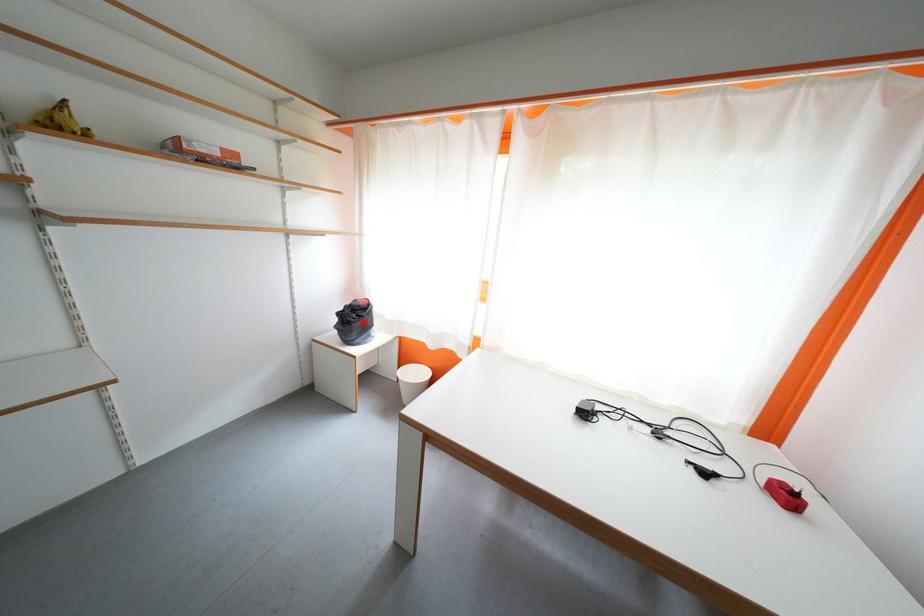
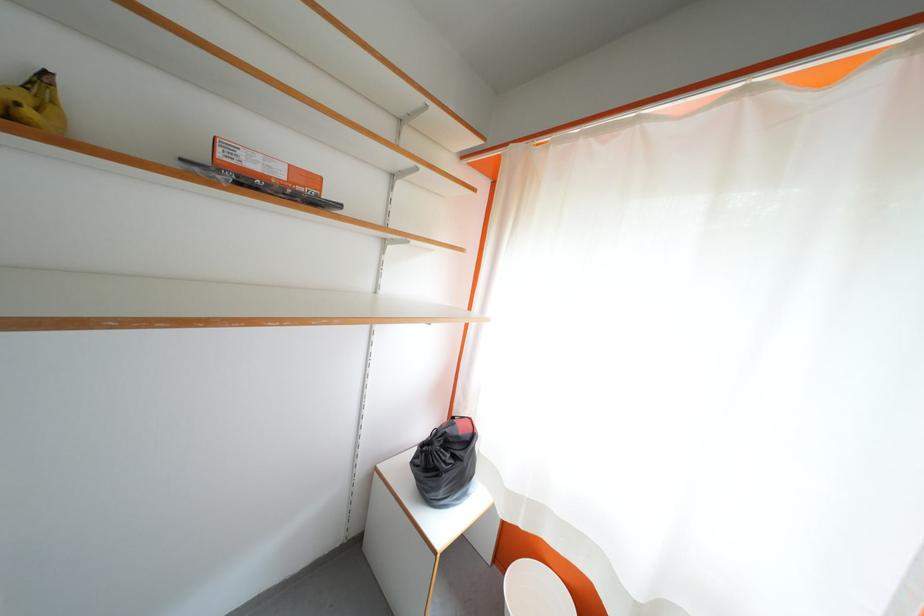
Where in the second image is the point corresponding to the highlighted location from the first image?

(455, 460)